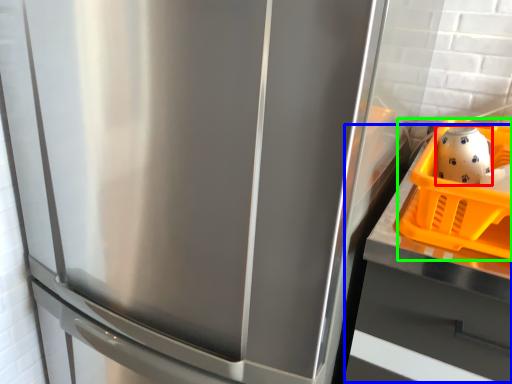
Question: Which object is positioned farthest from tea pot (highlighted by a red box)? Select from counter top (highlighted by a blue box) and basket (highlighted by a green box).

Choices:
 (A) counter top
 (B) basket

Answer: (A)